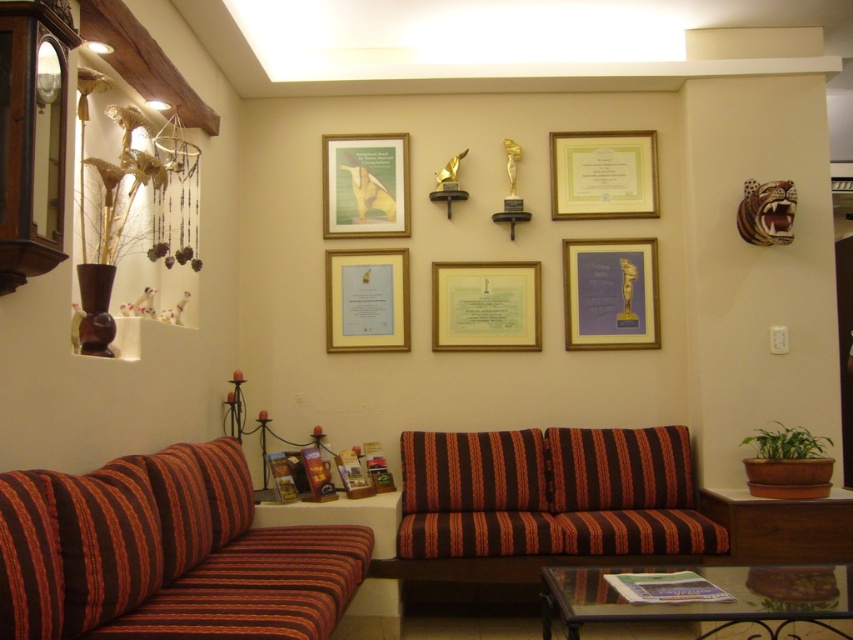
You are a guest entering the lounge and want to sit on the striped fabric couch at lower left. To reach it, you must walk past the matte green paper at center. Based on the scene description, is the couch above or below the paper?

The striped fabric couch at lower left is above the matte green paper at center, so the couch is positioned higher than the paper.

You are a maintenance worker needing to place a 1.2 meter long tool horizontally between the striped fabric couch at lower left and the matte green paper at center. Can the tool fit without bending?

The distance between the striped fabric couch at lower left and the matte green paper at center is 1.13 meters. Since the tool is 1.2 meters long, it cannot fit horizontally without bending.